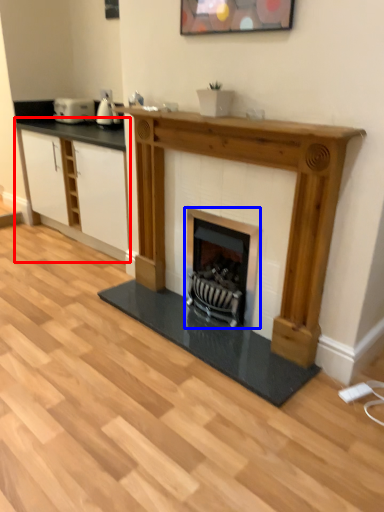
Question: Which point is closer to the camera, cabinetry (highlighted by a red box) or wood burning stove (highlighted by a blue box)?

Choices:
 (A) cabinetry
 (B) wood burning stove

Answer: (B)